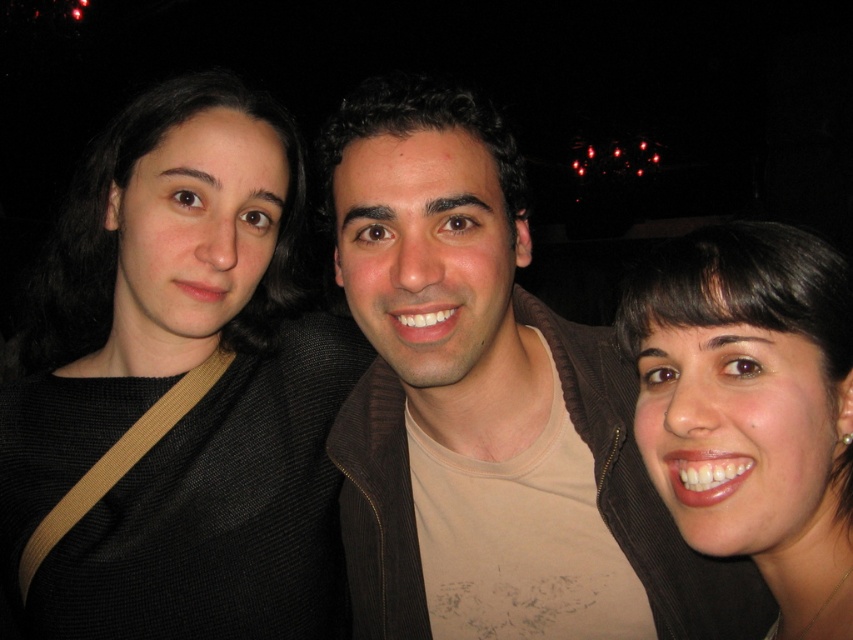
Based on the photo, how distant is black textured sweater at left from smooth skin face at center?

black textured sweater at left and smooth skin face at center are 56.13 centimeters apart.

Image resolution: width=853 pixels, height=640 pixels. What do you see at coordinates (177, 390) in the screenshot?
I see `black textured sweater at left` at bounding box center [177, 390].

You are a GUI agent. You are given a task and a screenshot of the screen. Output one action in this format:
    pyautogui.click(x=<x>, y=<y>)
    Task: Click on the black textured sweater at left
    
    Given the screenshot: What is the action you would take?
    pyautogui.click(x=177, y=390)